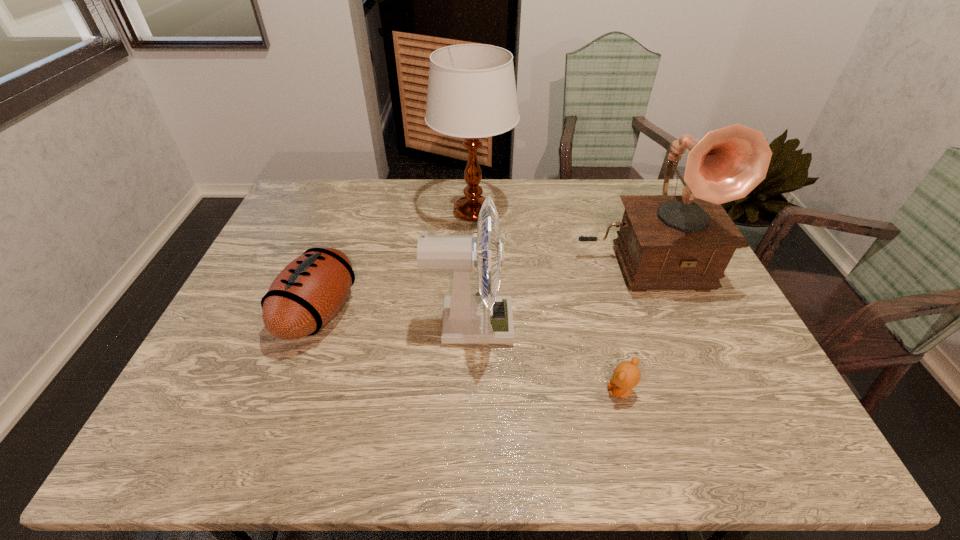
Where is `table lamp`? The width and height of the screenshot is (960, 540). table lamp is located at coordinates (471, 94).

Locate an element on the screen. record player is located at coordinates (666, 242).

Identify the location of the third shortest object. (486, 319).

Where is `the fourth tallest object`? This screenshot has height=540, width=960. the fourth tallest object is located at coordinates (309, 291).

Find the location of a particular element. The width and height of the screenshot is (960, 540). the leftmost object is located at coordinates (309, 291).

The width and height of the screenshot is (960, 540). I want to click on teddy bear, so click(x=626, y=376).

Where is `the shortest object`? This screenshot has width=960, height=540. the shortest object is located at coordinates (626, 376).

Image resolution: width=960 pixels, height=540 pixels. Identify the location of free space located on the left of the table lamp. (345, 212).

The image size is (960, 540). What are the coordinates of `vacant area situated 0.350m on the horn of the record player` in the screenshot? It's located at (704, 420).

Locate an element on the screen. The image size is (960, 540). blank space located on the front-facing side of the fan is located at coordinates (669, 325).